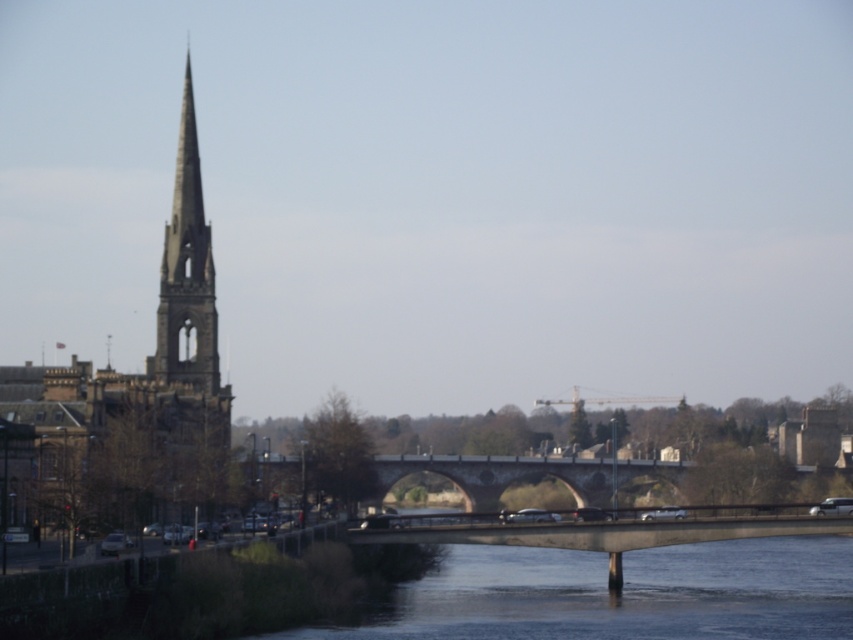
You are standing at the point with coordinates point (194, 198) and want to walk to the point with coordinates point (492, 627). Which direction should you move to reach your destination?

To reach point (492, 627) from point (194, 198), you should move forward since point (492, 627) is in front of point (194, 198).

You are a tourist standing in the middle of the dark gray concrete bridge at lower center and want to take a photo of the dark gray stone church steeple at left. In which direction should you point your camera to capture the steeple in the frame?

You should point your camera to the left to capture the dark gray stone church steeple at left since it is located to the left of the dark gray concrete bridge at lower center.

In the scene shown: You are a city planner assessing the urban layout. The dark gray concrete bridge at lower center and the smooth stone spire at left are both key structures. Based on their spatial relationship, which structure would likely allow for more vehicular traffic to pass underneath it?

The dark gray concrete bridge at lower center is wider than the smooth stone spire at left, so it would likely allow more vehicular traffic to pass underneath it.